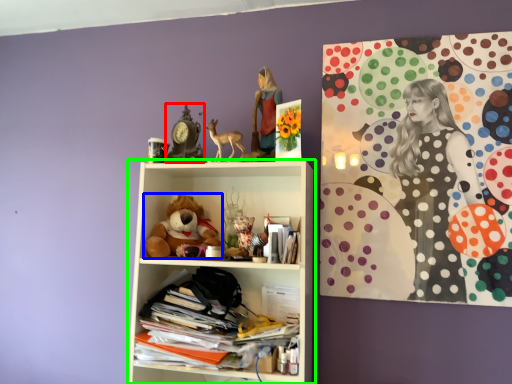
Question: Which is farther away from art (highlighted by a red box)? teddy bear (highlighted by a blue box) or shelf (highlighted by a green box)?

Choices:
 (A) teddy bear
 (B) shelf

Answer: (B)